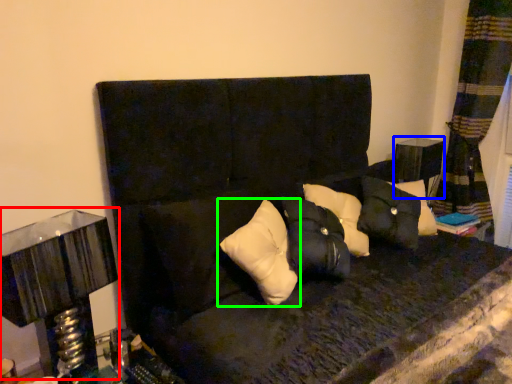
Question: Considering the real-world distances, which object is farthest from table lamp (highlighted by a red box)? table (highlighted by a blue box) or pillow (highlighted by a green box)?

Choices:
 (A) table
 (B) pillow

Answer: (A)